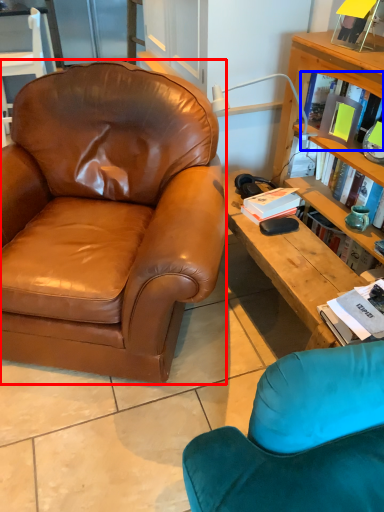
Question: Which object appears closest to the camera in this image, chair (highlighted by a red box) or book (highlighted by a blue box)?

Choices:
 (A) chair
 (B) book

Answer: (A)